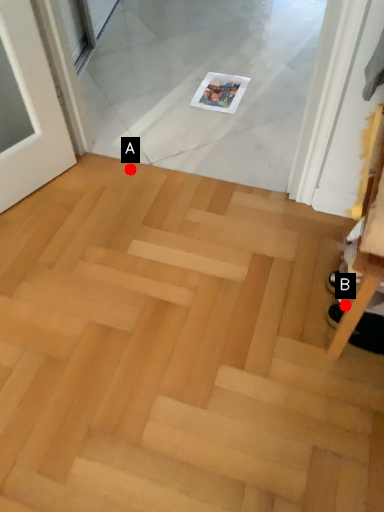
Question: Two points are circled on the image, labeled by A and B beside each circle. Which point appears farthest from the camera in this image?

Choices:
 (A) A is further
 (B) B is further

Answer: (A)